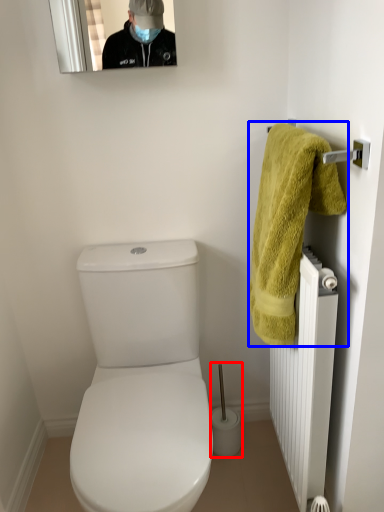
Question: Among these objects, which one is farthest to the camera, brush (highlighted by a red box) or towel (highlighted by a blue box)?

Choices:
 (A) brush
 (B) towel

Answer: (A)